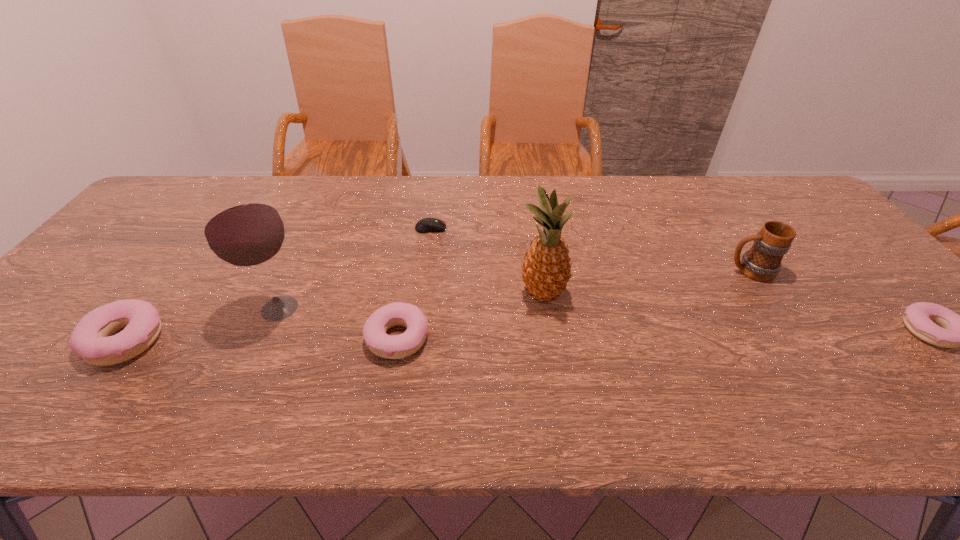
Where is `the leftmost doughnut`? This screenshot has width=960, height=540. the leftmost doughnut is located at coordinates (90, 339).

Identify the location of the second shortest doughnut. The image size is (960, 540). (403, 345).

You are a GUI agent. You are given a task and a screenshot of the screen. Output one action in this format:
    pyautogui.click(x=<x>, y=<y>)
    Task: Click on the second doughnut from right to left
    
    Given the screenshot: What is the action you would take?
    pyautogui.click(x=403, y=345)

The height and width of the screenshot is (540, 960). I want to click on the farthest object, so click(426, 225).

Locate an element on the screen. computer equipment is located at coordinates (426, 225).

Locate an element on the screen. the fifth object from left to right is located at coordinates (546, 270).

Find the location of a particular element. the sixth object from left to right is located at coordinates (762, 262).

The height and width of the screenshot is (540, 960). I want to click on the fifth shortest object, so click(762, 262).

In order to click on alcohol in this screenshot , I will do `click(242, 228)`.

You are a GUI agent. You are given a task and a screenshot of the screen. Output one action in this format:
    pyautogui.click(x=<x>, y=<y>)
    Task: Click on the free space located on the back of the leftmost doughnut
    
    Given the screenshot: What is the action you would take?
    pyautogui.click(x=218, y=217)